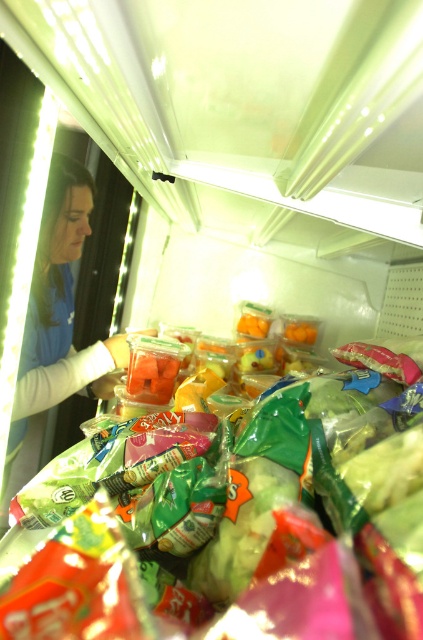
Question: Does translucent plastic bag of chips at center appear on the right side of blue fabric woman at left?

Choices:
 (A) yes
 (B) no

Answer: (A)

Question: Does translucent plastic bag of chips at center appear over blue fabric woman at left?

Choices:
 (A) yes
 (B) no

Answer: (A)

Question: Can you confirm if translucent plastic bag of chips at center is thinner than blue fabric woman at left?

Choices:
 (A) no
 (B) yes

Answer: (A)

Question: Which point is farther from the camera taking this photo?

Choices:
 (A) (68, 493)
 (B) (82, 179)

Answer: (B)

Question: Among these points, which one is nearest to the camera?

Choices:
 (A) (33, 337)
 (B) (220, 596)

Answer: (B)